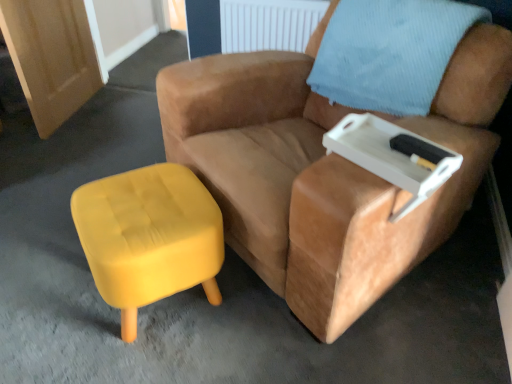
Question: Considering the relative sizes of light blue textured pillow at upper right and yellow fabric stool at lower left in the image provided, is light blue textured pillow at upper right thinner than yellow fabric stool at lower left?

Choices:
 (A) no
 (B) yes

Answer: (A)

Question: Is yellow fabric stool at lower left located within light blue textured pillow at upper right?

Choices:
 (A) no
 (B) yes

Answer: (A)

Question: Considering the relative sizes of light blue textured pillow at upper right and yellow fabric stool at lower left in the image provided, is light blue textured pillow at upper right wider than yellow fabric stool at lower left?

Choices:
 (A) yes
 (B) no

Answer: (A)

Question: Can you confirm if light blue textured pillow at upper right is bigger than yellow fabric stool at lower left?

Choices:
 (A) yes
 (B) no

Answer: (A)

Question: Can you confirm if light blue textured pillow at upper right is taller than yellow fabric stool at lower left?

Choices:
 (A) no
 (B) yes

Answer: (A)

Question: Is light blue textured pillow at upper right touching yellow fabric stool at lower left?

Choices:
 (A) no
 (B) yes

Answer: (A)

Question: From a real-world perspective, is white plastic tray at upper right positioned over light blue textured pillow at upper right based on gravity?

Choices:
 (A) yes
 (B) no

Answer: (B)

Question: Considering the relative sizes of white plastic tray at upper right and light blue textured pillow at upper right in the image provided, is white plastic tray at upper right shorter than light blue textured pillow at upper right?

Choices:
 (A) no
 (B) yes

Answer: (B)

Question: Does white plastic tray at upper right appear on the right side of light blue textured pillow at upper right?

Choices:
 (A) yes
 (B) no

Answer: (B)

Question: Does white plastic tray at upper right come in front of light blue textured pillow at upper right?

Choices:
 (A) yes
 (B) no

Answer: (A)

Question: Is white plastic tray at upper right with light blue textured pillow at upper right?

Choices:
 (A) yes
 (B) no

Answer: (B)

Question: Does white plastic tray at upper right appear on the left side of light blue textured pillow at upper right?

Choices:
 (A) yes
 (B) no

Answer: (A)

Question: Are white plastic tray at upper right and yellow fabric stool at lower left far apart?

Choices:
 (A) yes
 (B) no

Answer: (B)